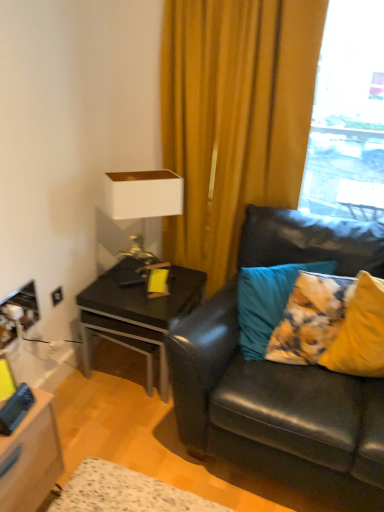
What do you see at coordinates (360, 332) in the screenshot? The image size is (384, 512). I see `yellow fabric pillow at right, which is the 2th pillow from left to right` at bounding box center [360, 332].

Image resolution: width=384 pixels, height=512 pixels. What do you see at coordinates (348, 116) in the screenshot?
I see `transparent glass window at upper right` at bounding box center [348, 116].

At what (x,y) coordinates should I click in order to perform the action: click on black leather couch at right. Please return your answer as a coordinate pair (x, y). Looking at the image, I should click on (276, 412).

Locate an element on the screen. window that is above the yellow fabric curtain at upper center (from the image's perspective) is located at coordinates (348, 116).

Considering the sizes of transparent glass window at upper right and yellow fabric curtain at upper center in the image, is transparent glass window at upper right bigger or smaller than yellow fabric curtain at upper center?

Considering their sizes, transparent glass window at upper right takes up less space than yellow fabric curtain at upper center.

Would you say transparent glass window at upper right is to the left or to the right of yellow fabric curtain at upper center in the picture?

Clearly, transparent glass window at upper right is on the right of yellow fabric curtain at upper center in the image.

Between transparent glass window at upper right and yellow fabric curtain at upper center, which one has larger width?

transparent glass window at upper right.

Which of these two, white matte table lamp at upper left or transparent glass window at upper right, is thinner?

transparent glass window at upper right is thinner.

Is the depth of white matte table lamp at upper left less than that of transparent glass window at upper right?

No, white matte table lamp at upper left is behind transparent glass window at upper right.

Does white matte table lamp at upper left have a smaller size compared to transparent glass window at upper right?

Indeed, white matte table lamp at upper left has a smaller size compared to transparent glass window at upper right.

Which is closer to the camera, (107, 196) or (368, 25)?

Point (368, 25)

Considering the sizes of objects transparent glass window at upper right and black leather couch at right in the image provided, who is thinner, transparent glass window at upper right or black leather couch at right?

Thinner between the two is transparent glass window at upper right.

Is point (325, 170) positioned before point (179, 377)?

That is False.

The height and width of the screenshot is (512, 384). In order to click on window on the right side of black leather couch at right in this screenshot , I will do `click(348, 116)`.

Can black leather couch at right be found inside transparent glass window at upper right?

No, black leather couch at right is not inside transparent glass window at upper right.

Which object is positioned more to the right, yellow fabric curtain at upper center or black leather couch at right?

black leather couch at right is more to the right.

Locate an element on the screen. Image resolution: width=384 pixels, height=512 pixels. studio couch below the yellow fabric curtain at upper center (from a real-world perspective) is located at coordinates (276, 412).

Looking at this image, considering the sizes of yellow fabric curtain at upper center and black leather couch at right in the image, is yellow fabric curtain at upper center wider or thinner than black leather couch at right?

yellow fabric curtain at upper center is thinner than black leather couch at right.

Which is in front, yellow fabric curtain at upper center or black leather couch at right?

black leather couch at right.

Is black glossy side table at left aimed at yellow fabric curtain at upper center?

No, black glossy side table at left is not oriented towards yellow fabric curtain at upper center.

Is black glossy side table at left not inside yellow fabric curtain at upper center?

black glossy side table at left is positioned outside yellow fabric curtain at upper center.

From the image's perspective, relative to yellow fabric curtain at upper center, is black glossy side table at left above or below?

From the image's perspective, black glossy side table at left appears below yellow fabric curtain at upper center.

Is black glossy side table at left bigger or smaller than yellow fabric curtain at upper center?

In the image, black glossy side table at left appears to be smaller than yellow fabric curtain at upper center.

Looking at the image, does yellow fabric pillow at right, which is the 1th pillow from right to left, seem bigger or smaller compared to teal fabric pillow at right, the 1th pillow in the left-to-right sequence?

In the image, yellow fabric pillow at right, which is the 1th pillow from right to left, appears to be smaller than teal fabric pillow at right, the 1th pillow in the left-to-right sequence.

Is yellow fabric pillow at right, which is the 2th pillow from left to right, with teal fabric pillow at right, the 1th pillow in the left-to-right sequence?

No.

This screenshot has height=512, width=384. Identify the location of pillow above the teal fabric pillow at right, the 1th pillow in the left-to-right sequence (from a real-world perspective). (x=360, y=332).

Based on the photo, could you measure the distance between yellow fabric pillow at right, which is the 2th pillow from left to right, and teal fabric pillow at right, the 1th pillow in the left-to-right sequence?

A distance of 11.62 inches exists between yellow fabric pillow at right, which is the 2th pillow from left to right, and teal fabric pillow at right, the 1th pillow in the left-to-right sequence.

Is black leather couch at right beside yellow fabric pillow at right, which is the 2th pillow from left to right?

No, black leather couch at right is not beside yellow fabric pillow at right, which is the 2th pillow from left to right.

From the image's perspective, is black leather couch at right on yellow fabric pillow at right, which is the 1th pillow from right to left?

Actually, black leather couch at right appears below yellow fabric pillow at right, which is the 1th pillow from right to left, in the image.

Considering the relative positions of black leather couch at right and yellow fabric pillow at right, which is the 1th pillow from right to left, in the image provided, is black leather couch at right to the left of yellow fabric pillow at right, which is the 1th pillow from right to left, from the viewer's perspective?

Correct, you'll find black leather couch at right to the left of yellow fabric pillow at right, which is the 1th pillow from right to left.

Identify the location of curtain below the transparent glass window at upper right (from the image's perspective). (234, 117).

Image resolution: width=384 pixels, height=512 pixels. What are the coordinates of `table lamp that appears below the transparent glass window at upper right (from a real-world perspective)` in the screenshot? It's located at (143, 195).

From the picture: Considering their positions, is yellow fabric pillow at right, which is the 1th pillow from right to left, positioned further to black leather couch at right than yellow fabric curtain at upper center?

yellow fabric curtain at upper center is further to black leather couch at right.

Estimate the real-world distances between objects in this image. Which object is closer to black glossy side table at left, yellow fabric curtain at upper center or black leather couch at right?

black leather couch at right is positioned closer to the anchor black glossy side table at left.

Considering their positions, is white matte table lamp at upper left positioned closer to yellow fabric curtain at upper center than teal fabric pillow at right, marked as the second pillow in a right-to-left arrangement?

white matte table lamp at upper left is positioned closer to the anchor yellow fabric curtain at upper center.

Based on their spatial positions, is teal fabric pillow at right, the 1th pillow in the left-to-right sequence, or transparent glass window at upper right closer to white matte table lamp at upper left?

teal fabric pillow at right, the 1th pillow in the left-to-right sequence, lies closer to white matte table lamp at upper left than the other object.

Which object lies nearer to the anchor point black glossy side table at left, teal fabric pillow at right, the 1th pillow in the left-to-right sequence, or yellow fabric pillow at right, which is the 2th pillow from left to right?

teal fabric pillow at right, the 1th pillow in the left-to-right sequence, is closer to black glossy side table at left.

Looking at the image, which one is located closer to yellow fabric curtain at upper center, yellow fabric pillow at right, which is the 2th pillow from left to right, or teal fabric pillow at right, the 1th pillow in the left-to-right sequence?

teal fabric pillow at right, the 1th pillow in the left-to-right sequence, is closer to yellow fabric curtain at upper center.

When comparing their distances from black glossy side table at left, does transparent glass window at upper right or teal fabric pillow at right, the 1th pillow in the left-to-right sequence, seem further?

transparent glass window at upper right.

Looking at the image, which one is located closer to teal fabric pillow at right, the 1th pillow in the left-to-right sequence, yellow fabric curtain at upper center or black leather couch at right?

Among the two, black leather couch at right is located nearer to teal fabric pillow at right, the 1th pillow in the left-to-right sequence.

Find the location of a particular element. The height and width of the screenshot is (512, 384). pillow between yellow fabric curtain at upper center and yellow fabric pillow at right, which is the 1th pillow from right to left, in the vertical direction is located at coordinates (267, 301).

At what (x,y) coordinates should I click in order to perform the action: click on pillow located between white matte table lamp at upper left and black leather couch at right in the left-right direction. Please return your answer as a coordinate pair (x, y). This screenshot has height=512, width=384. Looking at the image, I should click on (267, 301).

Locate an element on the screen. This screenshot has width=384, height=512. curtain located between black glossy side table at left and transparent glass window at upper right in the left-right direction is located at coordinates (234, 117).

Locate an element on the screen. curtain located between black leather couch at right and white matte table lamp at upper left in the depth direction is located at coordinates (234, 117).